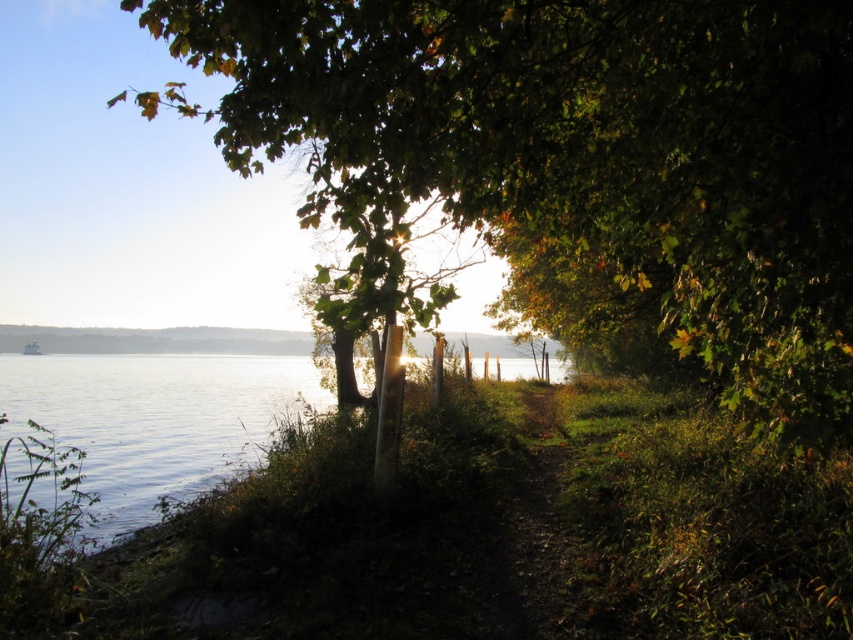
Question: Which point is closer to the camera?

Choices:
 (A) clear water at lower left
 (B) green leafy tree at center

Answer: (B)

Question: Can you confirm if green leafy tree at center is bigger than clear water at lower left?

Choices:
 (A) yes
 (B) no

Answer: (A)

Question: Is green leafy tree at center to the right of clear water at lower left from the viewer's perspective?

Choices:
 (A) yes
 (B) no

Answer: (A)

Question: Can you confirm if green leafy tree at center is positioned to the right of clear water at lower left?

Choices:
 (A) no
 (B) yes

Answer: (B)

Question: Which of the following is the closest to the observer?

Choices:
 (A) (508, 372)
 (B) (602, 198)

Answer: (B)

Question: Which point is farther to the camera?

Choices:
 (A) (231, 356)
 (B) (178, 32)

Answer: (A)